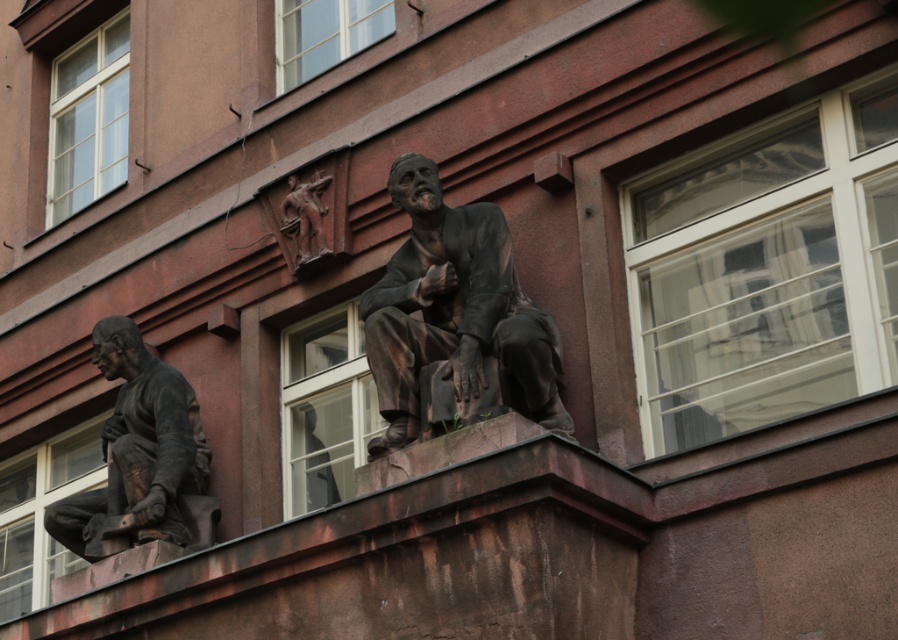
This screenshot has height=640, width=898. What are the coordinates of `bronze statue at upper center` in the screenshot? It's located at (455, 310).

Describe the element at coordinates (455, 310) in the screenshot. The height and width of the screenshot is (640, 898). I see `bronze statue at upper center` at that location.

Image resolution: width=898 pixels, height=640 pixels. In order to click on bronze statue at upper center in this screenshot , I will do `click(455, 310)`.